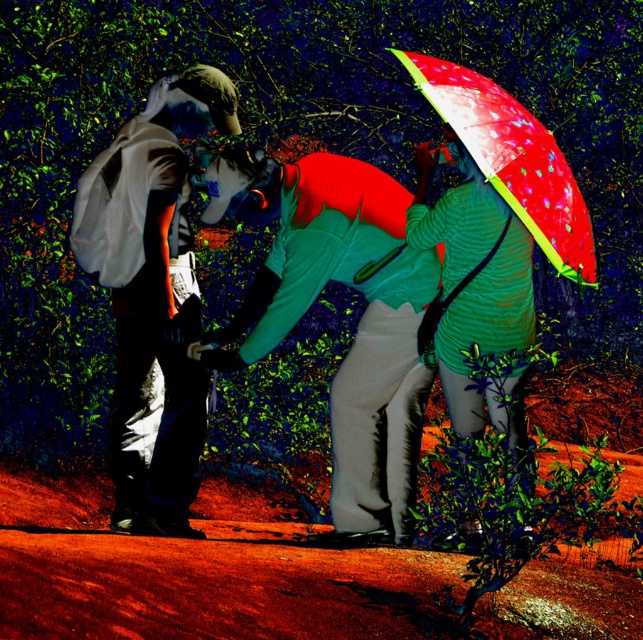
Question: Is matte white jacket at left below translucent plastic umbrella at upper right?

Choices:
 (A) yes
 (B) no

Answer: (A)

Question: Considering the relative positions of matte white jacket at left and translucent plastic umbrella at upper right in the image provided, where is matte white jacket at left located with respect to translucent plastic umbrella at upper right?

Choices:
 (A) below
 (B) above

Answer: (A)

Question: Which point is farther to the camera?

Choices:
 (A) (538, 170)
 (B) (285, 285)
 (C) (215, 109)
 (D) (458, 413)

Answer: (D)

Question: Which point is closer to the camera taking this photo?

Choices:
 (A) (258, 333)
 (B) (221, 84)

Answer: (A)

Question: Which of the following is the closest to the observer?

Choices:
 (A) (538, 176)
 (B) (377, 218)

Answer: (A)

Question: Can you confirm if matte white jacket at left is positioned to the left of translucent plastic umbrella at upper right?

Choices:
 (A) yes
 (B) no

Answer: (A)